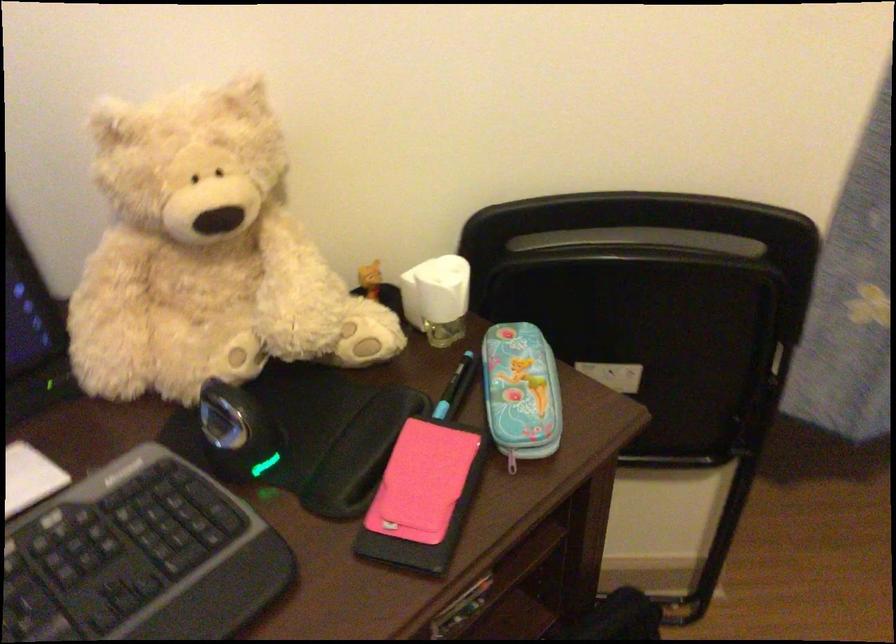
Find the location of a particular element. The height and width of the screenshot is (644, 896). pencil case zipper is located at coordinates (512, 460).